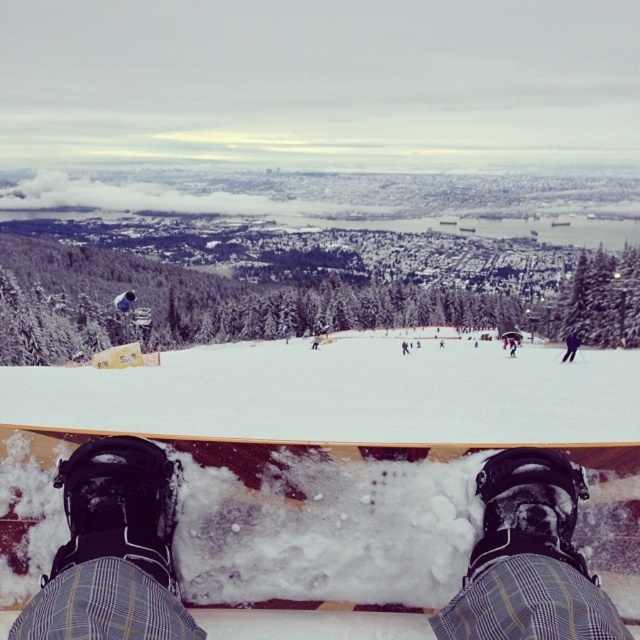
Question: Where is black matte snowboard boots at lower center located in relation to black matte snowboarder at center in the image?

Choices:
 (A) left
 (B) right

Answer: (A)

Question: Is white snowboard at center bigger than black matte snowboard boots at lower center?

Choices:
 (A) no
 (B) yes

Answer: (B)

Question: Which point appears closest to the camera in this image?

Choices:
 (A) (577, 604)
 (B) (564, 355)

Answer: (A)

Question: Which of the following is the farthest from the observer?

Choices:
 (A) white snowboard at center
 (B) black matte snowboarder at center

Answer: (B)

Question: Is the position of white snowboard at center less distant than that of black matte snowboarder at center?

Choices:
 (A) no
 (B) yes

Answer: (B)

Question: Considering the real-world distances, which object is farthest from the white snowboard at center?

Choices:
 (A) black matte snowboard boots at lower center
 (B) black matte snowboarder at center

Answer: (A)